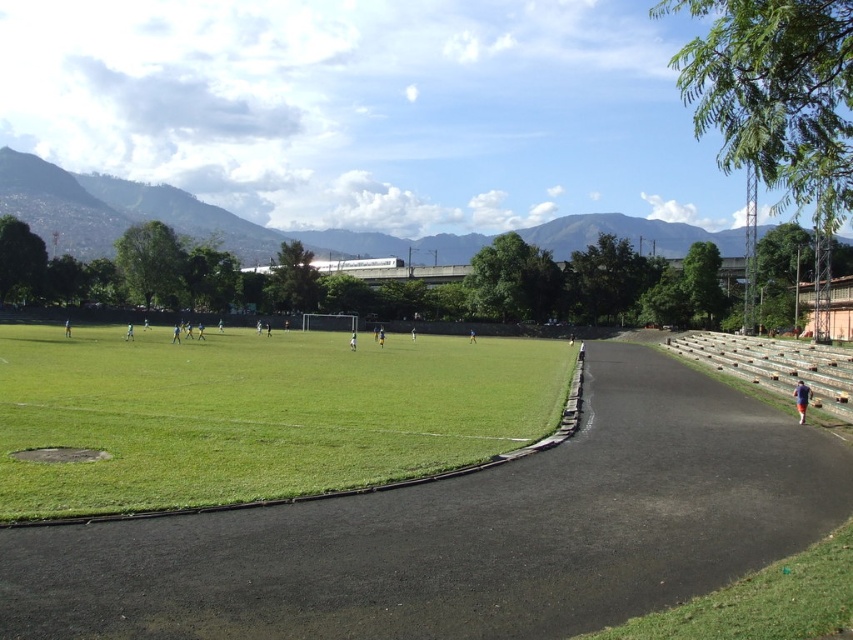
Can you confirm if black asphalt race track at center is smaller than green grass at lower right?

Actually, black asphalt race track at center might be larger than green grass at lower right.

In the scene shown: Which is below, black asphalt race track at center or green grass at lower right?

Positioned lower is black asphalt race track at center.

The image size is (853, 640). Describe the element at coordinates (466, 532) in the screenshot. I see `black asphalt race track at center` at that location.

The height and width of the screenshot is (640, 853). I want to click on black asphalt race track at center, so click(466, 532).

Is point (270, 477) positioned before point (728, 634)?

No.

Can you confirm if green grass at center is positioned below green grass at lower right?

Actually, green grass at center is above green grass at lower right.

Describe the element at coordinates (256, 412) in the screenshot. I see `green grass at center` at that location.

The image size is (853, 640). Identify the location of green grass at center. (256, 412).

Is green grass at center smaller than red cotton shirt at lower right?

Incorrect, green grass at center is not smaller in size than red cotton shirt at lower right.

From the picture: Which of these two, green grass at center or red cotton shirt at lower right, stands taller?

green grass at center is taller.

Describe the element at coordinates (256, 412) in the screenshot. I see `green grass at center` at that location.

Locate an element on the screen. Image resolution: width=853 pixels, height=640 pixels. green grass at center is located at coordinates (256, 412).